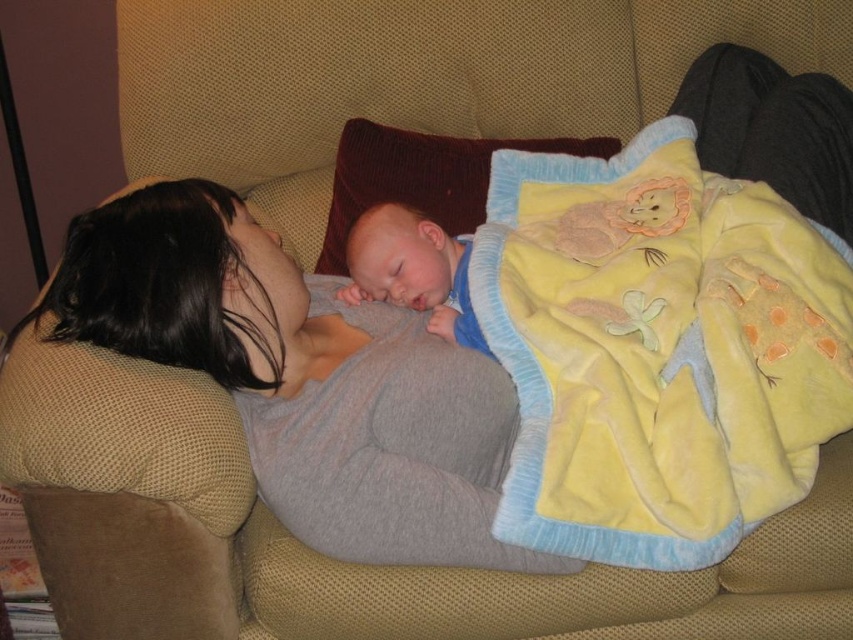
Is yellow fleece blanket at lower right smaller than brown fuzzy pillow at upper center?

Incorrect, yellow fleece blanket at lower right is not smaller in size than brown fuzzy pillow at upper center.

Can you confirm if yellow fleece blanket at lower right is shorter than brown fuzzy pillow at upper center?

No, yellow fleece blanket at lower right is not shorter than brown fuzzy pillow at upper center.

The height and width of the screenshot is (640, 853). What do you see at coordinates (657, 349) in the screenshot?
I see `yellow fleece blanket at lower right` at bounding box center [657, 349].

Locate an element on the screen. Image resolution: width=853 pixels, height=640 pixels. yellow fleece blanket at lower right is located at coordinates (657, 349).

Which is more to the left, yellow fleece blanket at lower right or soft blue fabric at center?

soft blue fabric at center

Which is in front, point (521, 296) or point (433, 321)?

Positioned in front is point (521, 296).

I want to click on yellow fleece blanket at lower right, so click(657, 349).

Find the location of a particular element. yellow fleece blanket at lower right is located at coordinates (657, 349).

Can you confirm if yellow fleece blanket at lower right is positioned below gray soft fabric at center?

No.

The image size is (853, 640). What are the coordinates of `yellow fleece blanket at lower right` in the screenshot? It's located at (657, 349).

Where is `yellow fleece blanket at lower right`? The width and height of the screenshot is (853, 640). yellow fleece blanket at lower right is located at coordinates (657, 349).